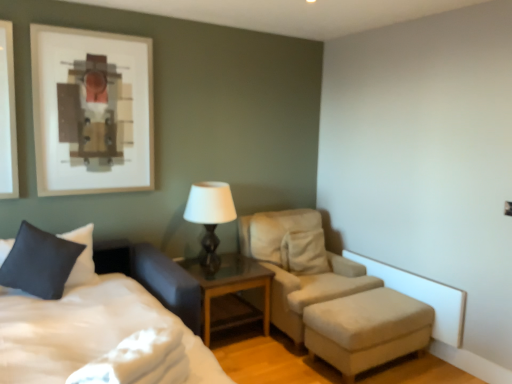
Question: From a real-world perspective, relative to matte black table lamp at center, is dark blue fabric pillow at lower left vertically above or below?

Choices:
 (A) above
 (B) below

Answer: (B)

Question: Considering the positions of dark blue fabric pillow at lower left and matte black table lamp at center in the image, is dark blue fabric pillow at lower left bigger or smaller than matte black table lamp at center?

Choices:
 (A) big
 (B) small

Answer: (B)

Question: Based on their relative distances, which object is nearer to the matte black table lamp at center?

Choices:
 (A) beige fabric chair at center
 (B) white soft bed at lower left
 (C) glass wood nightstand at center
 (D) beige fabric ottoman at lower right
 (E) dark blue fabric pillow at lower left

Answer: (C)

Question: Which of these objects is positioned closest to the white soft bed at lower left?

Choices:
 (A) beige fabric ottoman at lower right
 (B) dark blue fabric pillow at lower left
 (C) glass wood nightstand at center
 (D) beige fabric chair at center
 (E) matte black table lamp at center

Answer: (B)